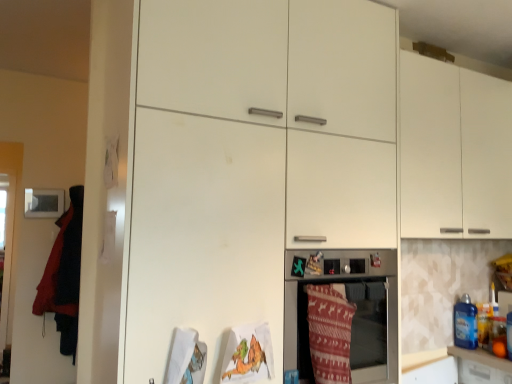
Measure the distance between point (469, 300) and camera.

7.99 feet.

Find the location of a particular element. The height and width of the screenshot is (384, 512). knitted woolen blanket at lower center, placed as the second blanket when sorted from back to front is located at coordinates (329, 334).

Locate an element on the screen. Image resolution: width=512 pixels, height=384 pixels. blue plastic bottle at right is located at coordinates (465, 323).

From the image's perspective, is velvet red blanket at left, which is the 1th blanket in left-to-right order, located above white matte cabinet at upper right?

Incorrect, from the image's perspective, velvet red blanket at left, which is the 1th blanket in left-to-right order, is lower than white matte cabinet at upper right.

How far apart are velvet red blanket at left, which ranks as the 1th blanket in back-to-front order, and white matte cabinet at upper right?

7.75 feet.

Is velvet red blanket at left, which is the 1th blanket in left-to-right order, in front of or behind white matte cabinet at upper right in the image?

In the image, velvet red blanket at left, which is the 1th blanket in left-to-right order, appears behind white matte cabinet at upper right.

Is velvet red blanket at left, placed as the 2th blanket when sorted from right to left, looking in the opposite direction of white matte cabinet at upper right?

No, velvet red blanket at left, placed as the 2th blanket when sorted from right to left, is not facing the opposite direction of white matte cabinet at upper right.

From the image's perspective, is white matte cabinet at upper right beneath knitted woolen blanket at lower center, placed as the second blanket when sorted from left to right?

Incorrect, from the image's perspective, white matte cabinet at upper right is higher than knitted woolen blanket at lower center, placed as the second blanket when sorted from left to right.

Is white matte cabinet at upper right behind knitted woolen blanket at lower center, placed as the second blanket when sorted from left to right?

Yes, it is.

Which of these two, white matte cabinet at upper right or knitted woolen blanket at lower center, placed as the second blanket when sorted from back to front, is thinner?

knitted woolen blanket at lower center, placed as the second blanket when sorted from back to front.

Considering the points (417, 76) and (330, 369), which point is in front, point (417, 76) or point (330, 369)?

The point (330, 369) is closer to the camera.

Is white matte cabinet at upper right facing away from velvet red blanket at left, positioned as the second blanket in front-to-back order?

That's not correct — white matte cabinet at upper right is not looking away from velvet red blanket at left, positioned as the second blanket in front-to-back order.

Is white matte cabinet at upper right to the left of velvet red blanket at left, positioned as the second blanket in front-to-back order, from the viewer's perspective?

In fact, white matte cabinet at upper right is to the right of velvet red blanket at left, positioned as the second blanket in front-to-back order.

Is white matte cabinet at upper right placed right next to velvet red blanket at left, placed as the 2th blanket when sorted from right to left?

white matte cabinet at upper right and velvet red blanket at left, placed as the 2th blanket when sorted from right to left, are not in contact.

Can you confirm if white matte cabinet at upper right is shorter than velvet red blanket at left, which is the 1th blanket in left-to-right order?

Indeed, white matte cabinet at upper right has a lesser height compared to velvet red blanket at left, which is the 1th blanket in left-to-right order.

From the picture: Which is correct: matte white oven at center is inside velvet red blanket at left, which is the 1th blanket in left-to-right order, or outside of it?

matte white oven at center is spatially situated outside velvet red blanket at left, which is the 1th blanket in left-to-right order.

Can you confirm if matte white oven at center is taller than velvet red blanket at left, positioned as the second blanket in front-to-back order?

Incorrect, the height of matte white oven at center is not larger of that of velvet red blanket at left, positioned as the second blanket in front-to-back order.

From a real-world perspective, is matte white oven at center over velvet red blanket at left, which is the 1th blanket in left-to-right order?

No, from a real-world perspective, matte white oven at center is not over velvet red blanket at left, which is the 1th blanket in left-to-right order

In the image, is velvet red blanket at left, positioned as the second blanket in front-to-back order, positioned in front of or behind knitted woolen blanket at lower center, the 1th blanket viewed from the right?

velvet red blanket at left, positioned as the second blanket in front-to-back order, is behind knitted woolen blanket at lower center, the 1th blanket viewed from the right.

Considering the sizes of objects velvet red blanket at left, which is the 1th blanket in left-to-right order, and knitted woolen blanket at lower center, placed as the second blanket when sorted from back to front, in the image provided, who is shorter, velvet red blanket at left, which is the 1th blanket in left-to-right order, or knitted woolen blanket at lower center, placed as the second blanket when sorted from back to front,?

With less height is knitted woolen blanket at lower center, placed as the second blanket when sorted from back to front.

Considering the sizes of objects velvet red blanket at left, which is the 1th blanket in left-to-right order, and knitted woolen blanket at lower center, placed as the 1th blanket when sorted from front to back, in the image provided, who is bigger, velvet red blanket at left, which is the 1th blanket in left-to-right order, or knitted woolen blanket at lower center, placed as the 1th blanket when sorted from front to back,?

With larger size is velvet red blanket at left, which is the 1th blanket in left-to-right order.

Is velvet red blanket at left, which ranks as the 1th blanket in back-to-front order, at the right side of knitted woolen blanket at lower center, placed as the 1th blanket when sorted from front to back?

Incorrect, velvet red blanket at left, which ranks as the 1th blanket in back-to-front order, is not on the right side of knitted woolen blanket at lower center, placed as the 1th blanket when sorted from front to back.

Between knitted woolen blanket at lower center, placed as the 1th blanket when sorted from front to back, and velvet red blanket at left, which is the 1th blanket in left-to-right order, which one appears on the right side from the viewer's perspective?

Positioned to the right is knitted woolen blanket at lower center, placed as the 1th blanket when sorted from front to back.

From the image's perspective, which object appears higher, knitted woolen blanket at lower center, placed as the second blanket when sorted from back to front, or velvet red blanket at left, which ranks as the 1th blanket in back-to-front order?

From the image's view, knitted woolen blanket at lower center, placed as the second blanket when sorted from back to front, is above.

Locate an element on the screen. The width and height of the screenshot is (512, 384). blanket below the knitted woolen blanket at lower center, placed as the 1th blanket when sorted from front to back (from the image's perspective) is located at coordinates (64, 275).

Relative to velvet red blanket at left, which is the 1th blanket in left-to-right order, is knitted woolen blanket at lower center, placed as the 1th blanket when sorted from front to back, in front or behind?

Clearly, knitted woolen blanket at lower center, placed as the 1th blanket when sorted from front to back, is in front of velvet red blanket at left, which is the 1th blanket in left-to-right order.

From the image's perspective, is matte white oven at center beneath white matte cabinet at upper right?

Yes.

Considering the positions of objects matte white oven at center and white matte cabinet at upper right in the image provided, who is behind, matte white oven at center or white matte cabinet at upper right?

Positioned behind is white matte cabinet at upper right.

Is matte white oven at center aimed at white matte cabinet at upper right?

No.

From a real-world perspective, who is located lower, matte white oven at center or white matte cabinet at upper right?

matte white oven at center, from a real-world perspective.

Find the location of a particular element. cabinetry on the right of velvet red blanket at left, which ranks as the 1th blanket in back-to-front order is located at coordinates (454, 151).

From the image's perspective, starting from the white matte cabinet at upper right, which blanket is the 1st one below? Please provide its 2D coordinates.

[(329, 334)]

Considering their positions, is white matte cabinet at upper right positioned closer to velvet red blanket at left, which ranks as the 1th blanket in back-to-front order, than matte white oven at center?

matte white oven at center lies closer to velvet red blanket at left, which ranks as the 1th blanket in back-to-front order, than the other object.

When comparing their distances from velvet red blanket at left, placed as the 2th blanket when sorted from right to left, does knitted woolen blanket at lower center, placed as the 1th blanket when sorted from front to back, or white matte cabinet at upper right seem closer?

knitted woolen blanket at lower center, placed as the 1th blanket when sorted from front to back, is closer to velvet red blanket at left, placed as the 2th blanket when sorted from right to left.

Based on their spatial positions, is blue plastic bottle at right or velvet red blanket at left, placed as the 2th blanket when sorted from right to left, closer to white matte cabinet at upper right?

blue plastic bottle at right is closer to white matte cabinet at upper right.

Which object lies nearer to the anchor point matte white oven at center, white matte cabinet at upper right or knitted woolen blanket at lower center, placed as the 1th blanket when sorted from front to back?

knitted woolen blanket at lower center, placed as the 1th blanket when sorted from front to back, lies closer to matte white oven at center than the other object.

When comparing their distances from matte white oven at center, does velvet red blanket at left, placed as the 2th blanket when sorted from right to left, or blue plastic bottle at right seem closer?

blue plastic bottle at right lies closer to matte white oven at center than the other object.

Considering their positions, is knitted woolen blanket at lower center, the 1th blanket viewed from the right, positioned closer to white matte cabinet at upper right than blue plastic bottle at right?

blue plastic bottle at right is closer to white matte cabinet at upper right.

From the image, which object appears to be nearer to velvet red blanket at left, positioned as the second blanket in front-to-back order, matte white oven at center or knitted woolen blanket at lower center, the 1th blanket viewed from the right?

Among the two, matte white oven at center is located nearer to velvet red blanket at left, positioned as the second blanket in front-to-back order.

Based on their spatial positions, is matte white oven at center or knitted woolen blanket at lower center, the 1th blanket viewed from the right, further from white matte cabinet at upper right?

knitted woolen blanket at lower center, the 1th blanket viewed from the right.

Find the location of a particular element. Image resolution: width=512 pixels, height=384 pixels. blanket between matte white oven at center and blue plastic bottle at right from left to right is located at coordinates (329, 334).

Image resolution: width=512 pixels, height=384 pixels. What are the coordinates of `home appliance between velvet red blanket at left, which is the 1th blanket in left-to-right order, and blue plastic bottle at right from left to right` in the screenshot? It's located at (353, 316).

At what (x,y) coordinates should I click in order to perform the action: click on home appliance located between velvet red blanket at left, which ranks as the 1th blanket in back-to-front order, and white matte cabinet at upper right in the left-right direction. Please return your answer as a coordinate pair (x, y). Looking at the image, I should click on (353, 316).

Identify the location of home appliance between white matte cabinet at upper right and knitted woolen blanket at lower center, the 1th blanket viewed from the right, in the up-down direction. This screenshot has width=512, height=384. (353, 316).